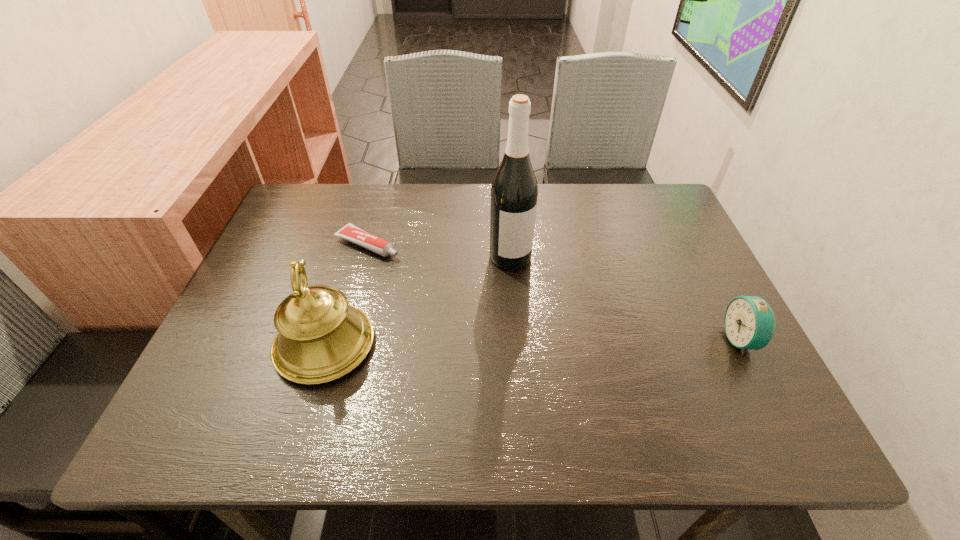
Identify the location of vacant space on the desktop that is between the second tallest object and the third tallest object and is positioned on the label of the third object from left to right. (550, 342).

Locate an element on the screen. This screenshot has height=540, width=960. free space on the desktop that is between the bell and the third tallest object and is positioned at the nozzle of the toothpaste is located at coordinates (576, 341).